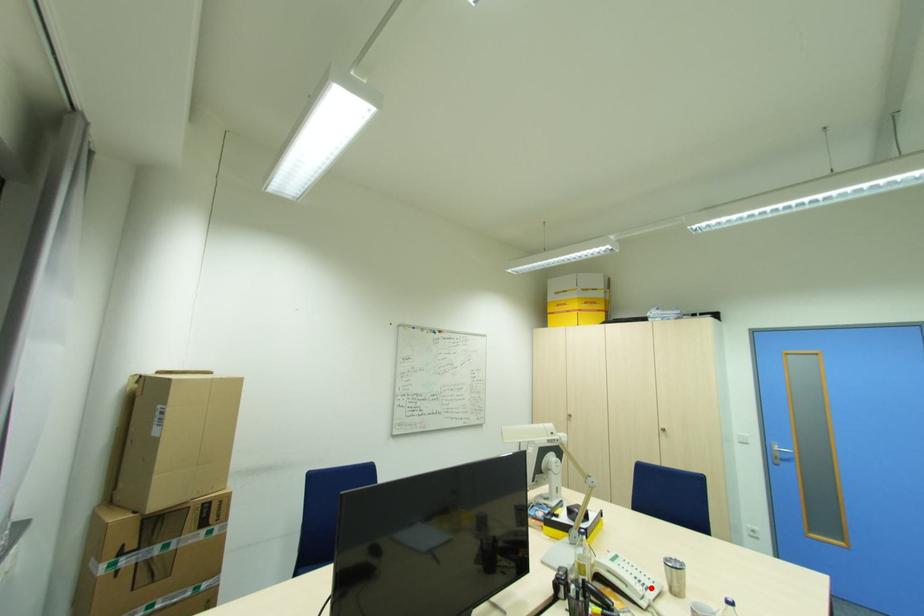
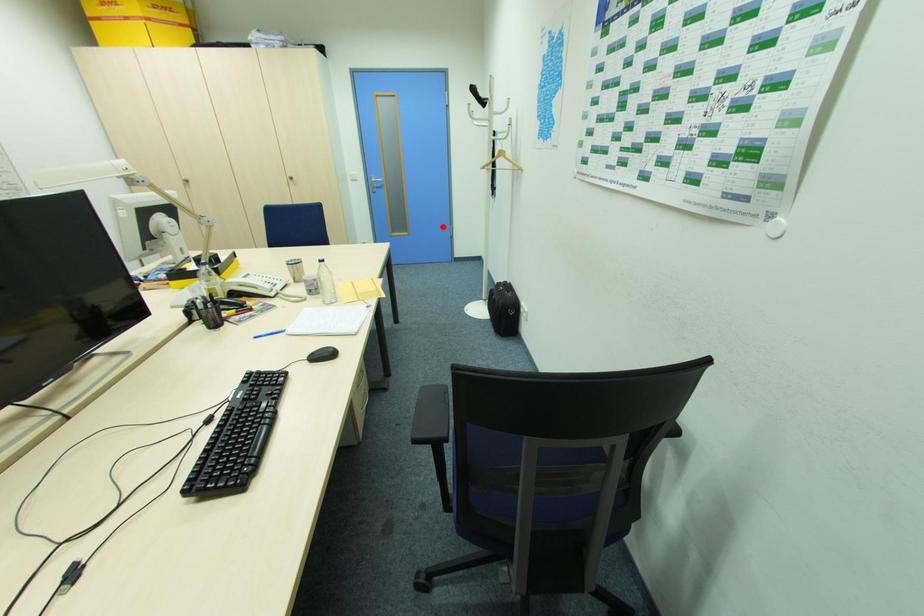
I am providing you with two images of the same scene from different viewpoints. A red point is marked on the first image and another point is marked on the second image. Is the red point in image1 aligned with the point shown in image2?

No